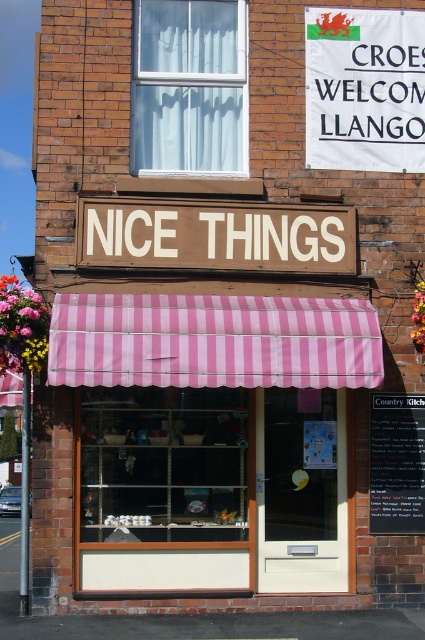
You are a customer standing in front of the shop and want to read both the brown wooden sign at center and the black chalkboard at lower right. Which one do you need to look up to see first?

The brown wooden sign at center is larger than the black chalkboard at lower right, so you need to look up to see the brown wooden sign at center first.

You are standing in front of the shop and want to hang a new decoration. The decoration requires a support point that is higher than the pink striped awning at center but lower than the white fabric banner at upper center. Is there a suitable spot available between these two objects?

The pink striped awning at center has a lesser height compared to white fabric banner at upper center, so there is a suitable spot between them for hanging the decoration as it needs to be higher than the pink striped awning at center but lower than the white fabric banner at upper center.